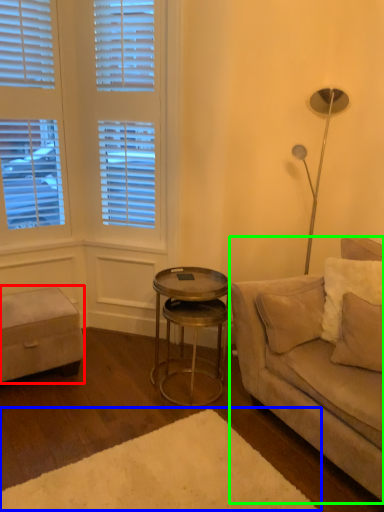
Question: Which is nearer to the music stool (highlighted by a red box)? plain (highlighted by a blue box) or studio couch (highlighted by a green box).

Choices:
 (A) plain
 (B) studio couch

Answer: (A)